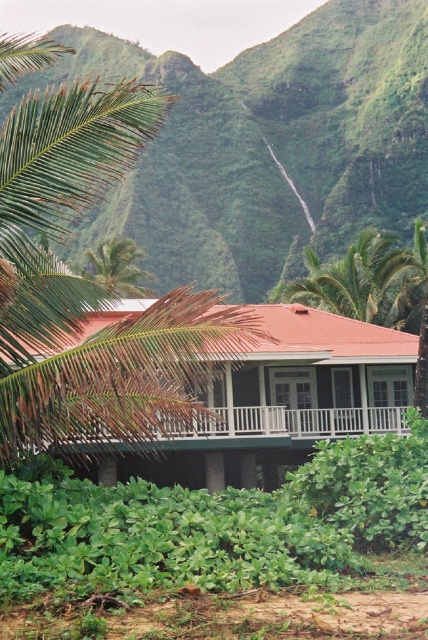
Question: Which object is positioned farthest from the green leafy palm tree at center-left?

Choices:
 (A) white wooden porch at center
 (B) green leafy palm tree at center

Answer: (B)

Question: Which point is closer to the camera?

Choices:
 (A) (53, 116)
 (B) (395, 326)

Answer: (A)

Question: Where is green leafy palm tree at center located in relation to green leafy palm tree at upper left in the image?

Choices:
 (A) right
 (B) left

Answer: (A)

Question: Among these objects, which one is nearest to the camera?

Choices:
 (A) white wooden porch at center
 (B) green leafy palm tree at center-left
 (C) green leafy palm tree at center

Answer: (B)

Question: Can you confirm if green leafy palm tree at center-left is positioned below green leafy palm tree at center?

Choices:
 (A) no
 (B) yes

Answer: (A)

Question: Is white wooden porch at center below green leafy palm tree at upper left?

Choices:
 (A) no
 (B) yes

Answer: (B)